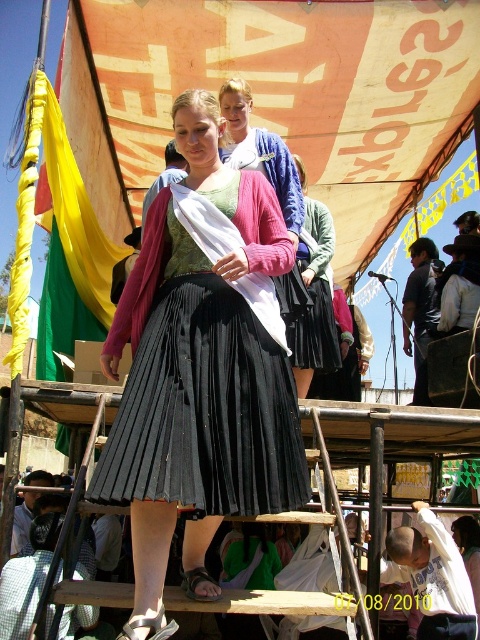
Can you confirm if black pleated skirt at center is smaller than matte pink sweater at center?

Yes.

Who is more distant from viewer, (196, 417) or (243, 163)?

The point (243, 163) is more distant.

Find the location of a particular element. black pleated skirt at center is located at coordinates (197, 392).

Between point (276, 284) and point (313, 248), which one is positioned behind?

The point (313, 248) is behind.

Does matte pink sweater at center have a lesser height compared to matte black skirt at center?

No.

This screenshot has width=480, height=640. Identify the location of matte pink sweater at center. (263, 157).

Is point (184, 269) positioned before point (311, 291)?

Yes, point (184, 269) is in front of point (311, 291).

Who is positioned more to the right, black pleated skirt at center or matte black skirt at center?

Positioned to the right is matte black skirt at center.

Which is in front, point (155, 435) or point (299, 262)?

Positioned in front is point (155, 435).

What are the coordinates of `black pleated skirt at center` in the screenshot? It's located at (197, 392).